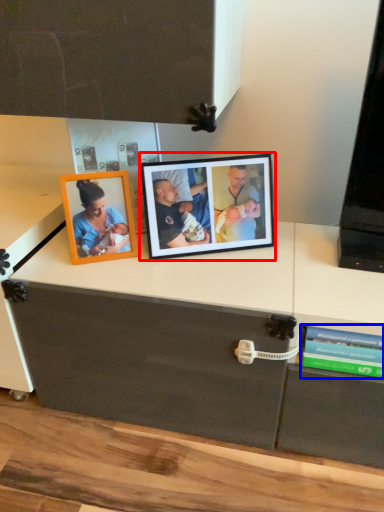
Question: Which object appears closest to the camera in this image, picture frame (highlighted by a red box) or book (highlighted by a blue box)?

Choices:
 (A) picture frame
 (B) book

Answer: (B)